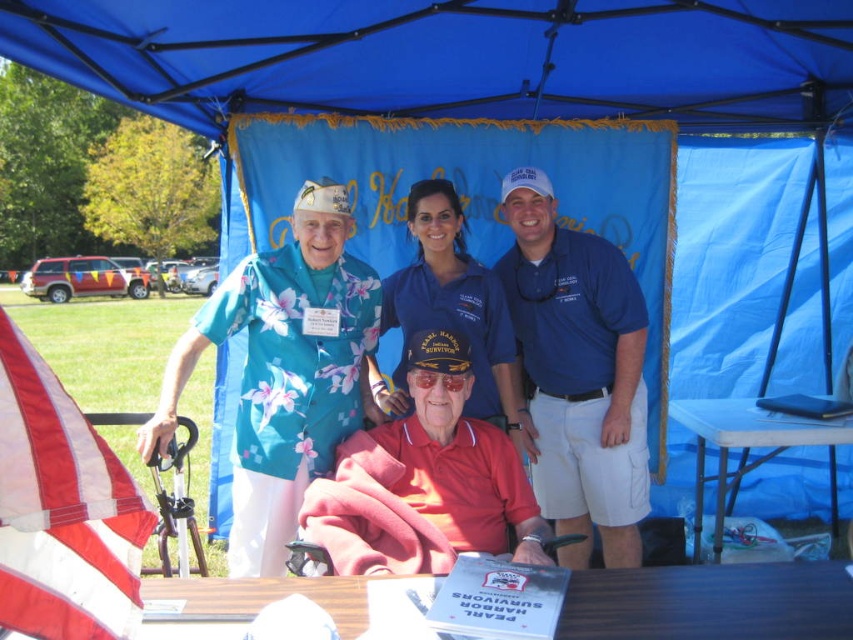
You are a photographer standing at the front of the scene. You need to take a photo that includes both the blue cotton polo shirt at center and the blue plastic table at lower right. Which object will appear closer to you in the photo?

The blue cotton polo shirt at center will appear closer to you in the photo because it is further to the viewer than the blue plastic table at lower right.

You are standing at the blue canopy tent and want to take a photo. There are two points marked on the ground at coordinates point (4, 577) and point (834, 577). Which point is closer to you where you can stand to capture both the banner and the table in the foreground clearly?

Point (4, 577) is closer to the viewer than point (834, 577), so standing at point (4, 577) will allow you to capture both the banner and the table in the foreground clearly since it is nearer to your position.